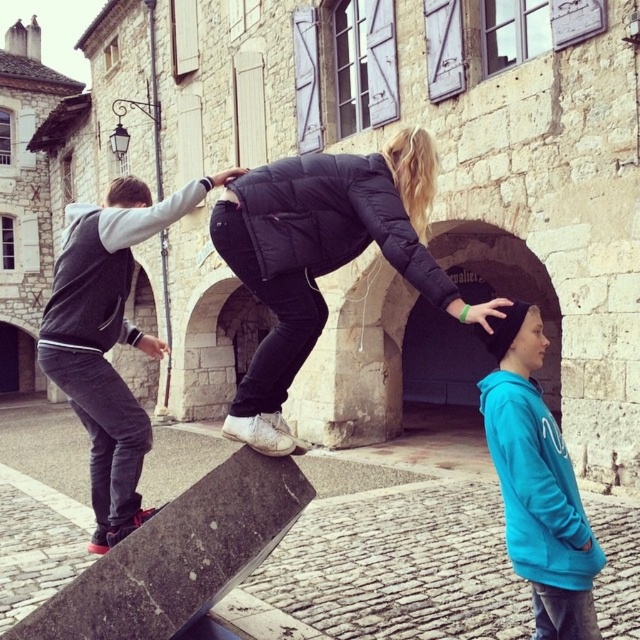
Question: Among these points, which one is nearest to the camera?

Choices:
 (A) (234, 435)
 (B) (108, 429)
 (C) (566, 513)

Answer: (C)

Question: Does black puffer jacket at center lie behind dark gray hoodie at left?

Choices:
 (A) yes
 (B) no

Answer: (B)

Question: Which point appears closest to the camera in this image?

Choices:
 (A) (268, 442)
 (B) (166, 220)
 (C) (554, 428)

Answer: (C)

Question: Can you confirm if black puffer jacket at center is positioned to the right of dark gray hoodie at left?

Choices:
 (A) no
 (B) yes

Answer: (B)

Question: Does dark gray hoodie at left appear under turquoise hoodie at right?

Choices:
 (A) yes
 (B) no

Answer: (B)

Question: Among these objects, which one is farthest from the camera?

Choices:
 (A) black puffer jacket at center
 (B) turquoise hoodie at right
 (C) dark gray hoodie at left

Answer: (C)